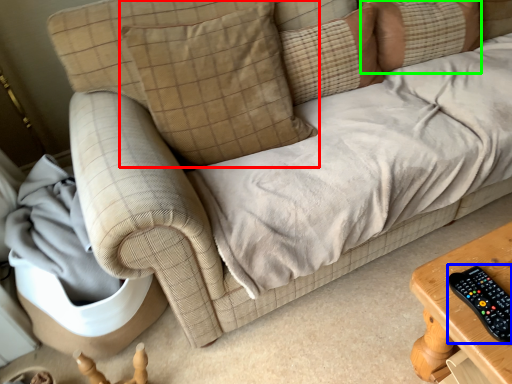
Question: Which is nearer to the pillow (highlighted by a red box)? control (highlighted by a blue box) or pillow (highlighted by a green box).

Choices:
 (A) control
 (B) pillow

Answer: (B)